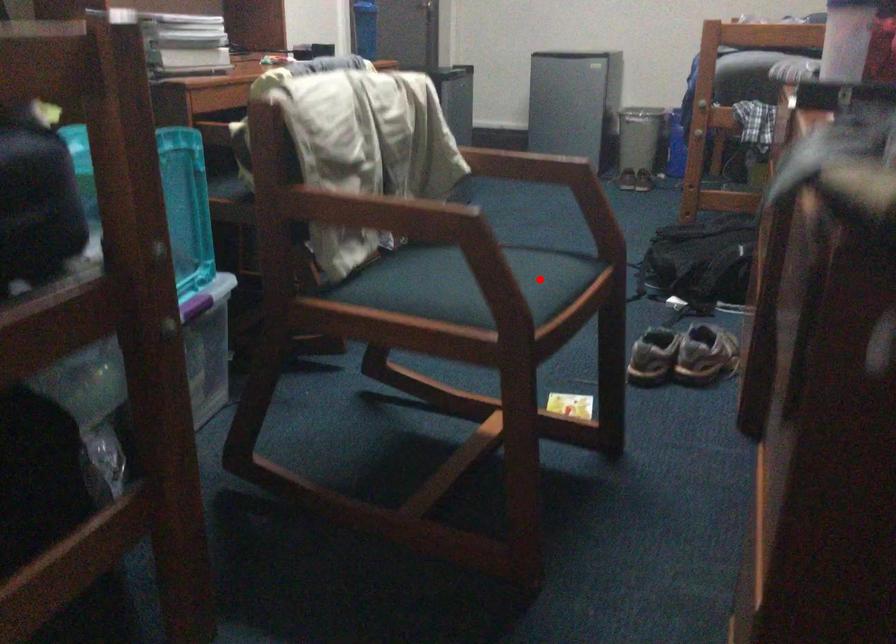
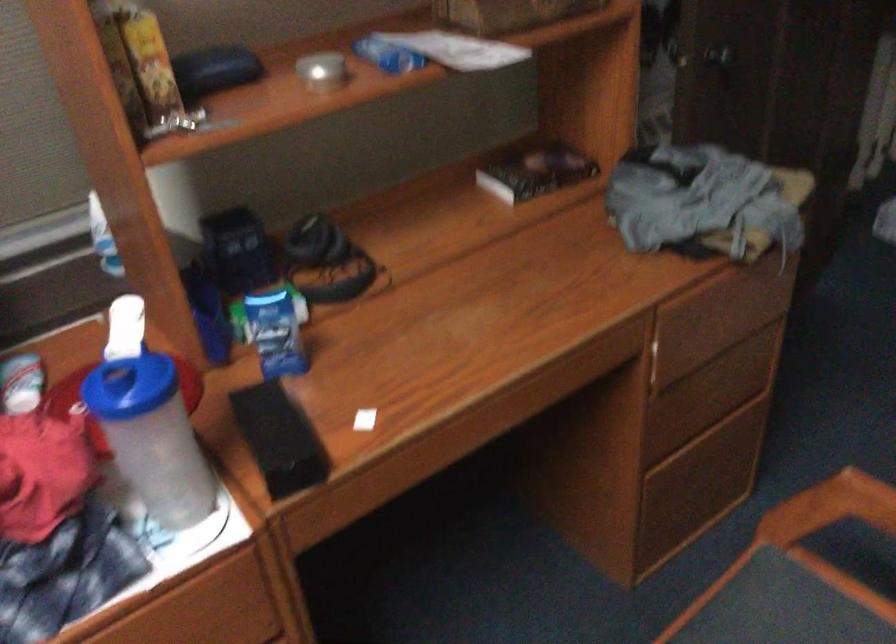
Question: I am providing you with two images of the same scene from different viewpoints. A red point is shown in image1. For the corresponding object point in image2, is it positioned nearer or farther from the camera?

Choices:
 (A) Nearer
 (B) Farther

Answer: (A)